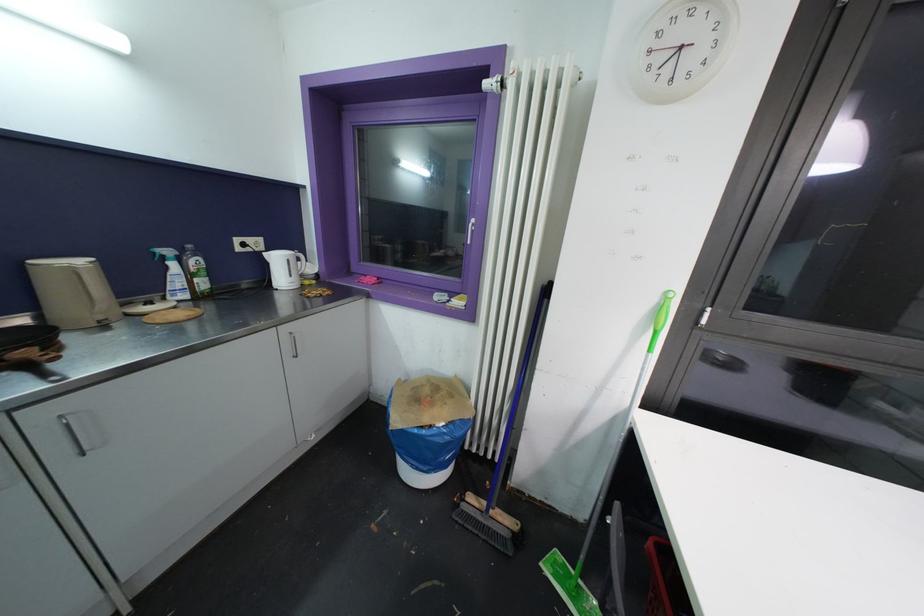
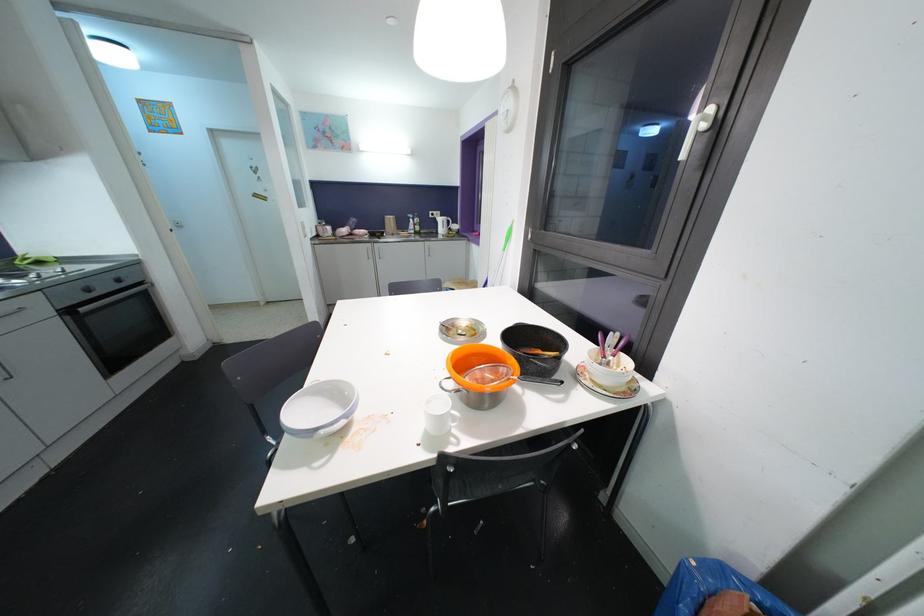
Locate, in the second image, the point that corresponds to pixel 281 262 in the first image.

(444, 223)